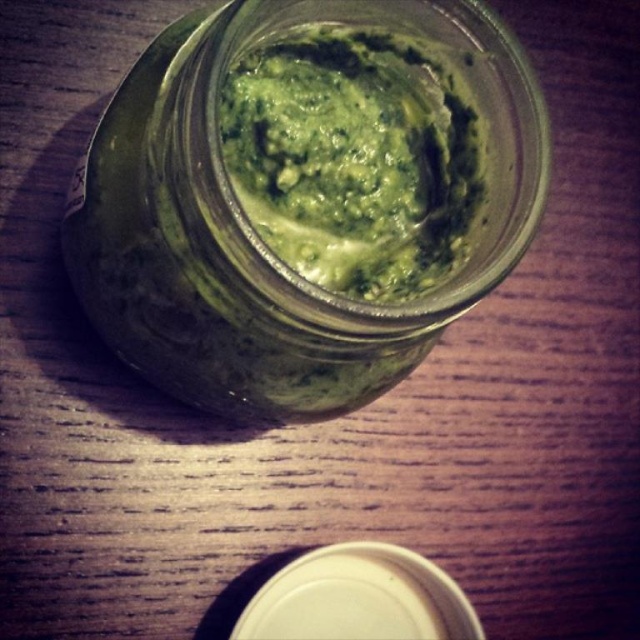
You are holding a spoon and want to scoop the green paste at center from the green matte glass jar at center. Since the jar is closer to you, will the spoon reach the paste?

The green matte glass jar at center is closer to the viewer than the green paste at center, so the spoon will easily reach the paste as the jar is nearer to you.

You are a chef preparing a dish and need to pour the green paste at center into a container. Can you pour it directly into the green matte glass jar at center without spilling?

The green matte glass jar at center is positioned under green paste at center, so pouring the green paste at center directly into the green matte glass jar at center would likely result in a spill since the jar is already underneath the paste.